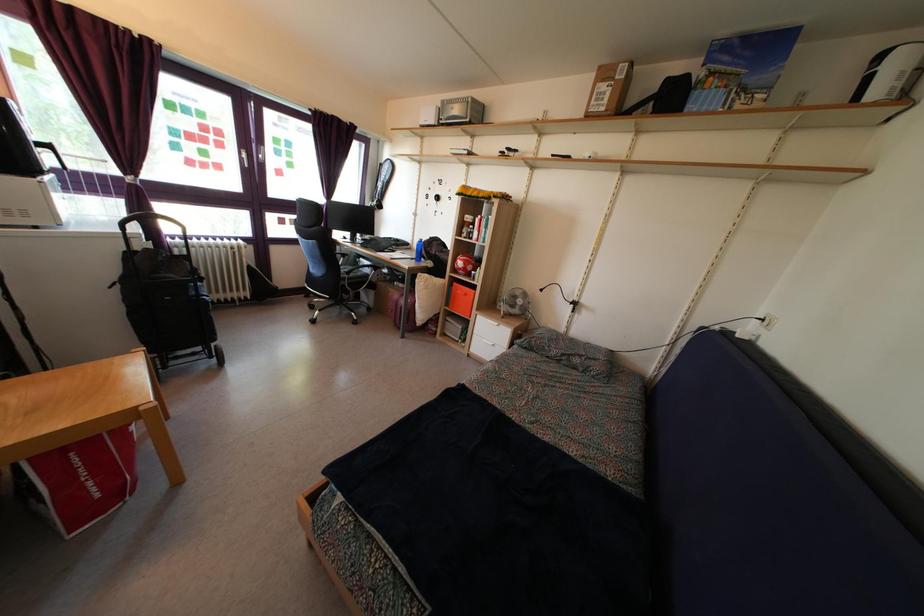
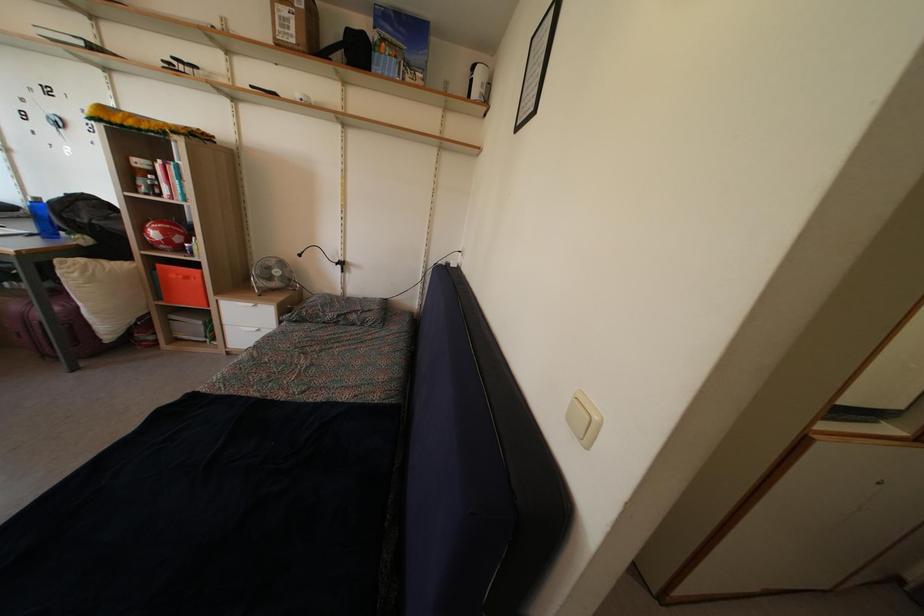
In the second image, find the point that corresponds to [523,310] in the first image.

(280, 281)